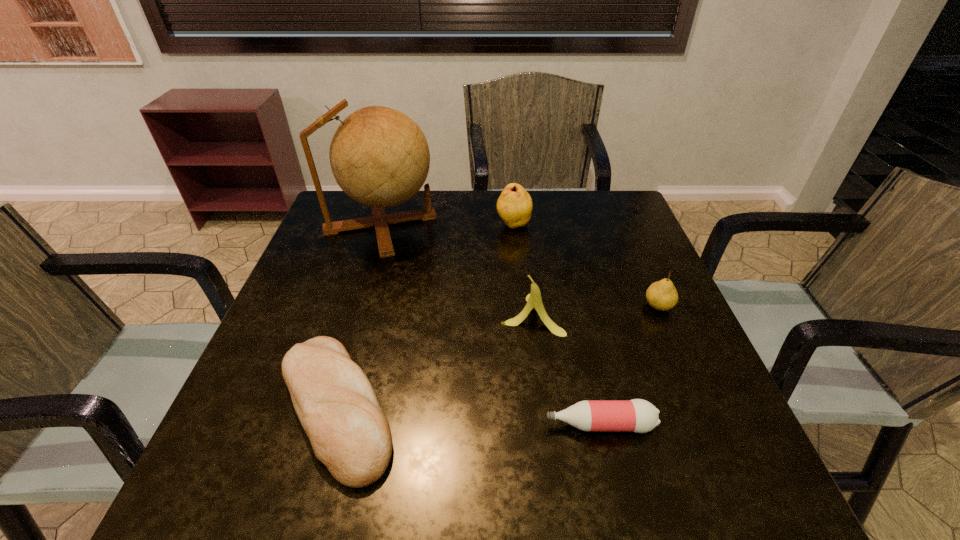
I want to click on bread that is positioned at the left edge, so click(335, 402).

This screenshot has width=960, height=540. Find the location of `pear present at the right edge`. pear present at the right edge is located at coordinates (662, 295).

At what (x,y) coordinates should I click in order to perform the action: click on bottle present at the right edge. Please return your answer as a coordinate pair (x, y). The image size is (960, 540). Looking at the image, I should click on (637, 415).

At what (x,y) coordinates should I click in order to perform the action: click on object present at the far left corner. Please return your answer as a coordinate pair (x, y). This screenshot has height=540, width=960. Looking at the image, I should click on (379, 156).

You are a GUI agent. You are given a task and a screenshot of the screen. Output one action in this format:
    pyautogui.click(x=<x>, y=<y>)
    Task: Click on the object at the near left corner
    This screenshot has width=960, height=540.
    Given the screenshot: What is the action you would take?
    pyautogui.click(x=335, y=402)

The height and width of the screenshot is (540, 960). Find the location of `vacant space at the far edge of the desktop`. vacant space at the far edge of the desktop is located at coordinates (539, 197).

You are a GUI agent. You are given a task and a screenshot of the screen. Output one action in this format:
    pyautogui.click(x=<x>, y=<y>)
    Task: Click on the free spot at the near edge of the desktop
    The image size is (960, 540).
    Given the screenshot: What is the action you would take?
    pyautogui.click(x=419, y=513)

Locate an element on the screen. vacant space at the left edge of the desktop is located at coordinates (269, 356).

What are the coordinates of `vacant space at the right edge of the desktop` in the screenshot? It's located at (653, 272).

Locate an element on the screen. vacant space at the near left corner of the desktop is located at coordinates (298, 471).